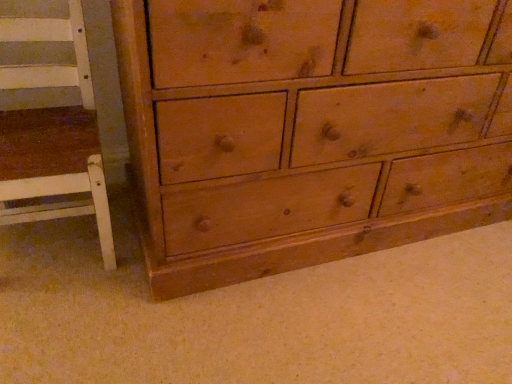
Find the location of a particular element. The height and width of the screenshot is (384, 512). white wood armchair at left is located at coordinates (53, 133).

What is the approximate height of white wood armchair at left?

white wood armchair at left is 24.28 inches tall.

Image resolution: width=512 pixels, height=384 pixels. What do you see at coordinates (53, 133) in the screenshot?
I see `white wood armchair at left` at bounding box center [53, 133].

I want to click on white wood armchair at left, so click(53, 133).